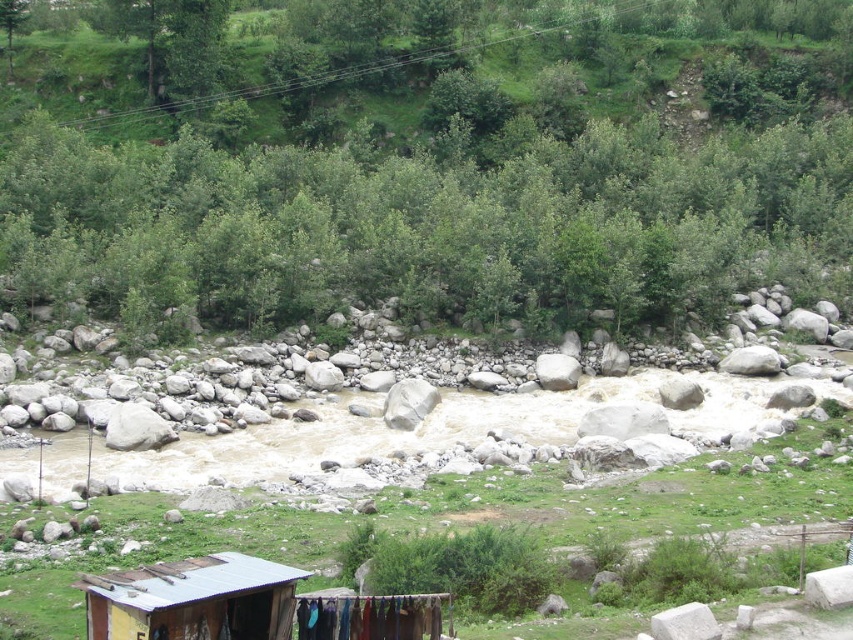
Who is higher up, green leafy tree at upper center or rusty metal hut at lower left?

Positioned higher is green leafy tree at upper center.

Who is positioned more to the left, green leafy tree at upper center or rusty metal hut at lower left?

green leafy tree at upper center is more to the left.

This screenshot has width=853, height=640. I want to click on green leafy tree at upper center, so click(451, 168).

Identify the location of green leafy tree at upper center. (451, 168).

Does green leafy tree at upper center appear on the right side of green grass at center?

No, green leafy tree at upper center is not to the right of green grass at center.

Does point (129, 68) come closer to viewer compared to point (248, 554)?

No, it is behind (248, 554).

Find the location of `green leafy tree at upper center`. green leafy tree at upper center is located at coordinates (451, 168).

Does green grass at center have a lesser width compared to rusty metal hut at lower left?

Incorrect, green grass at center's width is not less than rusty metal hut at lower left's.

Does green grass at center appear over rusty metal hut at lower left?

No, green grass at center is not above rusty metal hut at lower left.

Does point (471, 508) come closer to viewer compared to point (230, 637)?

No.

Find the location of a particular element. The image size is (853, 640). green grass at center is located at coordinates (451, 520).